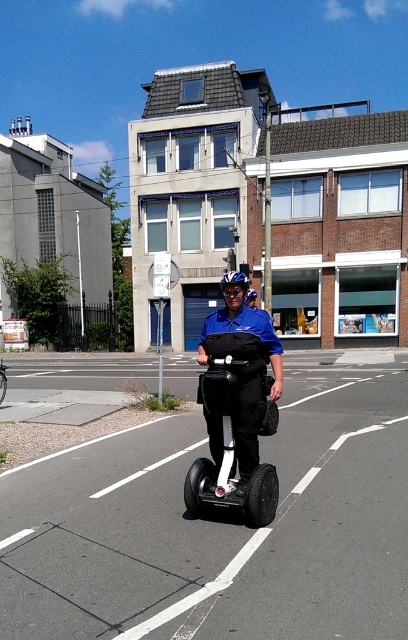
Question: Which point is farther to the camera?

Choices:
 (A) (212, 401)
 (B) (250, 380)

Answer: (B)

Question: Which point is farther to the camera?

Choices:
 (A) matte blue uniform at center
 (B) white glossy scooter at center

Answer: (A)

Question: Which point appears farthest from the camera in this image?

Choices:
 (A) (208, 321)
 (B) (204, 378)

Answer: (A)

Question: Can you confirm if matte blue uniform at center is positioned below white glossy scooter at center?

Choices:
 (A) no
 (B) yes

Answer: (A)

Question: Where is matte blue uniform at center located in relation to white glossy scooter at center in the image?

Choices:
 (A) left
 (B) right

Answer: (A)

Question: Can you confirm if matte blue uniform at center is positioned below white glossy scooter at center?

Choices:
 (A) no
 (B) yes

Answer: (A)